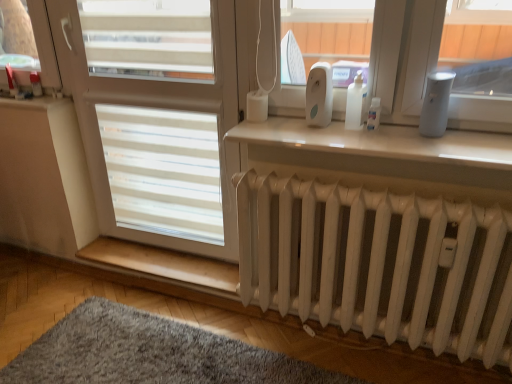
Question: Considering the positions of light brown wood at lower center and white matte radiator at lower center in the image, is light brown wood at lower center bigger or smaller than white matte radiator at lower center?

Choices:
 (A) small
 (B) big

Answer: (A)

Question: From the image's perspective, relative to white matte radiator at lower center, is light brown wood at lower center above or below?

Choices:
 (A) below
 (B) above

Answer: (A)

Question: Which object is the farthest from the white matte screen door at center?

Choices:
 (A) white glossy radiator at lower center
 (B) white matte radiator at lower center
 (C) gray fluffy rug at lower left
 (D) white plastic device at upper center
 (E) light brown wood at lower center

Answer: (C)

Question: Which of these objects is positioned closest to the white matte screen door at center?

Choices:
 (A) white matte radiator at lower center
 (B) white glossy radiator at lower center
 (C) gray fluffy rug at lower left
 (D) white plastic device at upper center
 (E) light brown wood at lower center

Answer: (B)